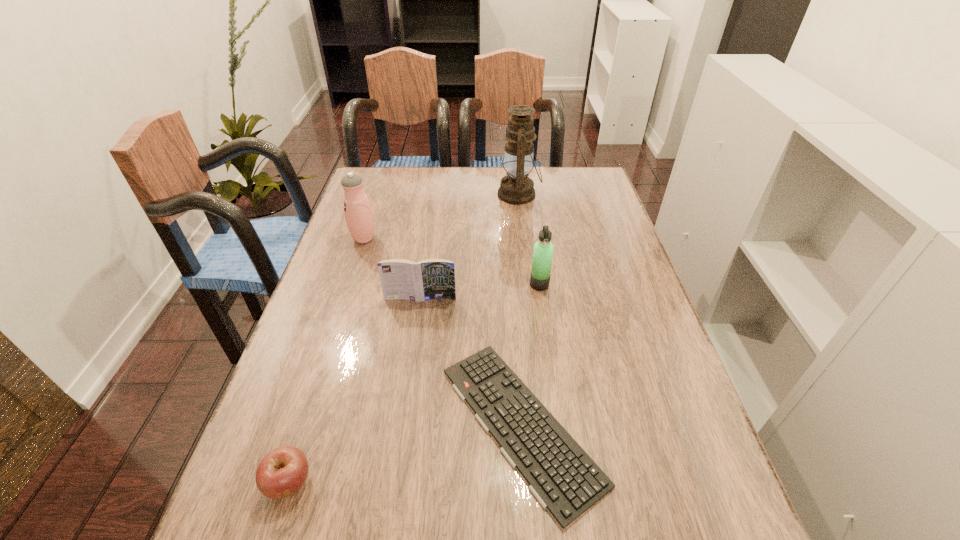
Locate an element on the screen. free spot located on the front of the tallest object is located at coordinates (525, 246).

Find the location of a particular element. free space located on the back of the left thermos bottle is located at coordinates (372, 213).

Identify the location of free space located on the front of the shorter thermos bottle. (557, 404).

Where is `vacant region located on the front cover of the third shortest object`? vacant region located on the front cover of the third shortest object is located at coordinates (408, 388).

The image size is (960, 540). I want to click on vacant space situated on the side of the apple with the unique marking, so click(272, 539).

I want to click on free space located 0.190m on the back of the computer keyboard, so click(x=511, y=292).

Locate an element on the screen. This screenshot has height=540, width=960. object situated at the far edge is located at coordinates (516, 188).

Identify the location of thermos bottle that is at the left edge. Image resolution: width=960 pixels, height=540 pixels. (359, 217).

At what (x,y) coordinates should I click in order to perform the action: click on apple that is positioned at the left edge. Please return your answer as a coordinate pair (x, y). Looking at the image, I should click on (283, 471).

Identify the location of free region at the far edge. The width and height of the screenshot is (960, 540). (541, 188).